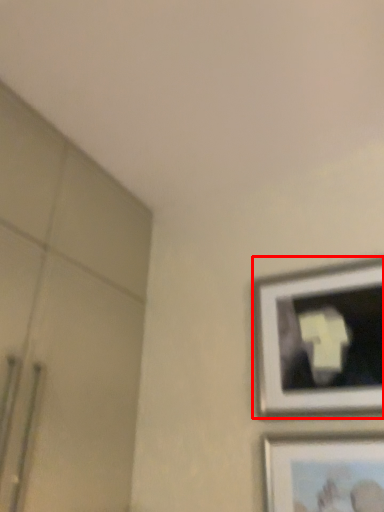
Question: Where is picture frame (annotated by the red box) located in relation to picture frame in the image?

Choices:
 (A) right
 (B) left

Answer: (B)